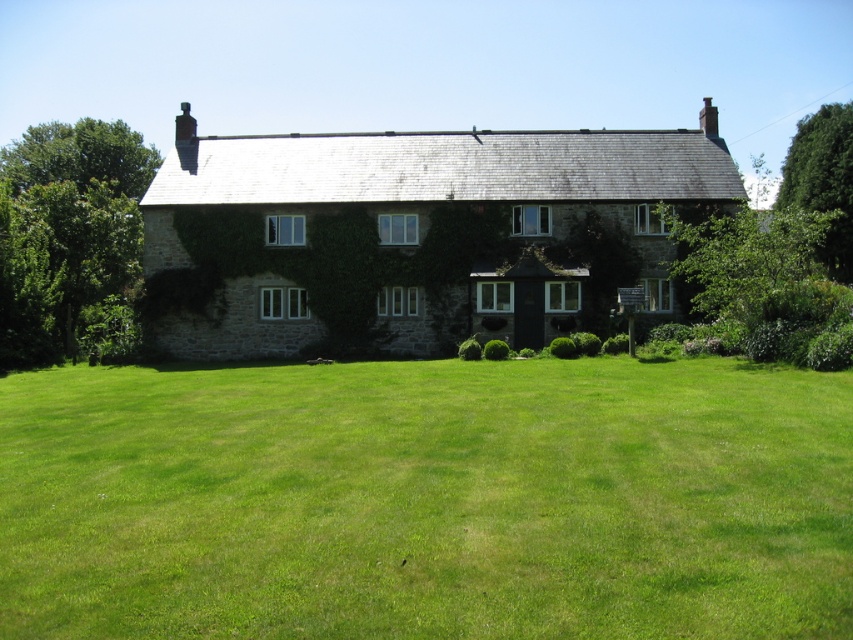
Is point (135, 444) in front of point (549, 237)?

Yes, it is.

Is point (430, 634) closer to camera compared to point (440, 317)?

Yes, point (430, 634) is in front of point (440, 317).

The height and width of the screenshot is (640, 853). Find the location of `green grass at center`. green grass at center is located at coordinates (427, 500).